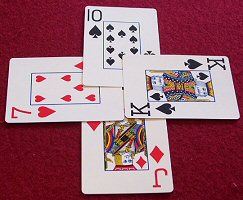
You are a GUI agent. You are given a task and a screenshot of the screen. Output one action in this format:
    pyautogui.click(x=<x>, y=<y>)
    Task: Click on the red felt poker table top
    The width and height of the screenshot is (243, 200).
    Given the screenshot: What is the action you would take?
    (206, 38)